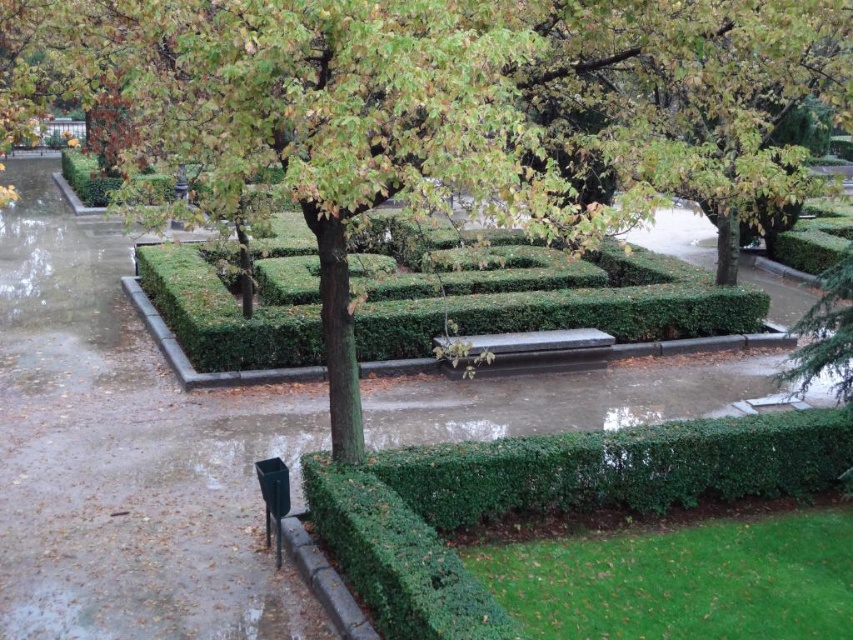
Question: Which point appears farthest from the camera in this image?

Choices:
 (A) (561, 513)
 (B) (621, 298)
 (C) (524, 353)
 (D) (659, 52)

Answer: (B)

Question: Which object is positioned farthest from the smooth dark brown bench at center?

Choices:
 (A) green leafy hedge at center
 (B) green leafy hedge at lower right
 (C) green leafy tree at center

Answer: (B)

Question: Among these objects, which one is farthest from the camera?

Choices:
 (A) green leafy tree at center
 (B) green leafy hedge at center
 (C) green leafy hedge at lower right
 (D) smooth dark brown bench at center

Answer: (D)

Question: From the image, what is the correct spatial relationship of green leafy hedge at lower right in relation to smooth dark brown bench at center?

Choices:
 (A) below
 (B) above

Answer: (A)

Question: Observing the image, what is the correct spatial positioning of green leafy tree at center in reference to green leafy hedge at center?

Choices:
 (A) above
 (B) below

Answer: (A)

Question: Is green leafy tree at center thinner than green leafy hedge at center?

Choices:
 (A) yes
 (B) no

Answer: (B)